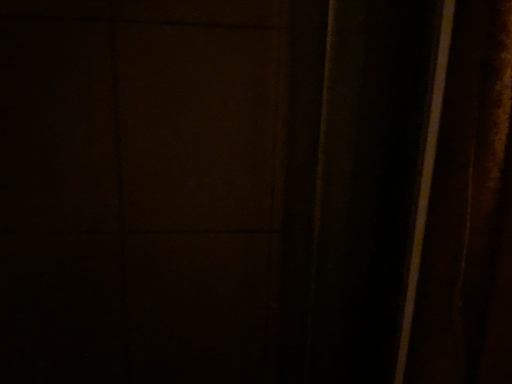
Describe the element at coordinates (469, 212) in the screenshot. The width and height of the screenshot is (512, 384). I see `velvet-like brown curtain at right` at that location.

What is the approximate width of velvet-like brown curtain at right?

It is 5.83 inches.

What is the approximate height of velvet-like brown curtain at right?

velvet-like brown curtain at right is 47.46 centimeters tall.

The width and height of the screenshot is (512, 384). I want to click on velvet-like brown curtain at right, so click(x=469, y=212).

This screenshot has width=512, height=384. In order to click on velvet-like brown curtain at right in this screenshot , I will do `click(469, 212)`.